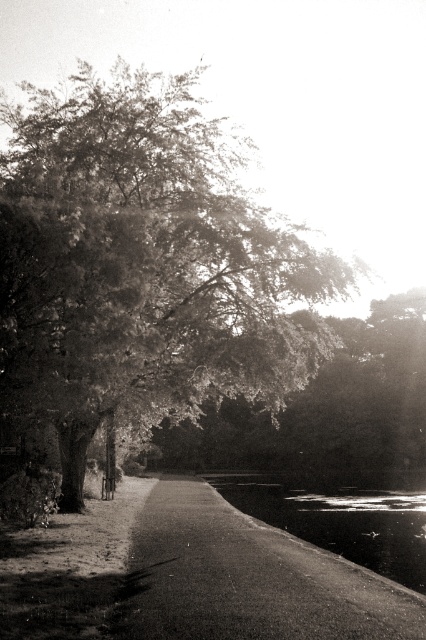
From the picture: You are standing at point [322,589] and want to walk towards the large tree on the left side of the path. Is the point [178,188] located behind you or in front of you relative to your direction of movement?

Since you are facing towards the large tree on the left side of the path, point [178,188] is behind you relative to your direction of movement because it is behind point [322,589] according to the spatial description.

You are standing at the center of the paved pathway in the image. Looking towards the grainy black tree at upper left, in which direction relative to the path does it appear?

The grainy black tree at upper left is located to the left side of the path.

You are a hiker walking along the smooth asphalt path at center and want to reach the tree on the left. Can you walk directly to the grainy black tree at upper left from your current position?

Yes, you can walk directly to the grainy black tree at upper left from your current position on the smooth asphalt path at center since the tree is positioned to the left of the path, which is the direction you want to go.